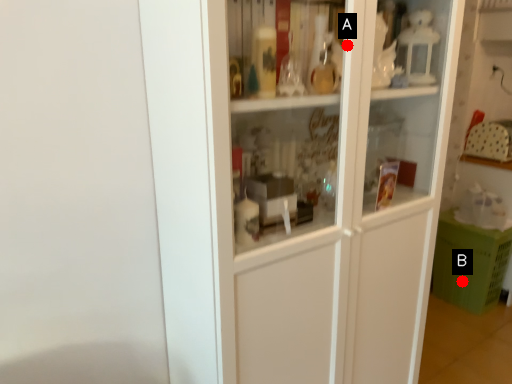
Question: Two points are circled on the image, labeled by A and B beside each circle. Which point is further to the camera?

Choices:
 (A) A is further
 (B) B is further

Answer: (B)